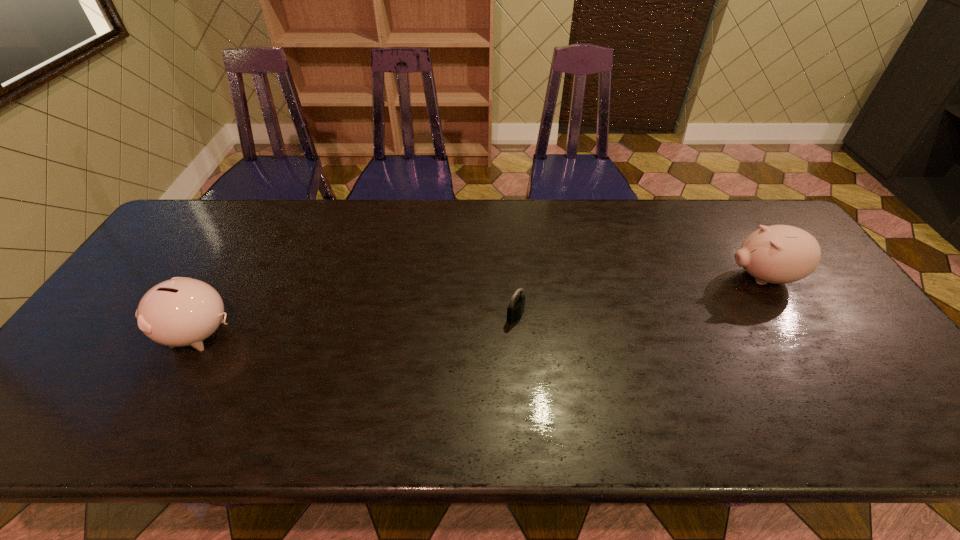
The height and width of the screenshot is (540, 960). Find the location of `vacant position located 0.180m on the front of the shortest object`. vacant position located 0.180m on the front of the shortest object is located at coordinates (520, 385).

I want to click on object that is at the right edge, so click(779, 254).

Image resolution: width=960 pixels, height=540 pixels. Identify the location of free spot at the far edge of the desktop. [610, 216].

Locate an element on the screen. This screenshot has width=960, height=540. vacant space at the near edge is located at coordinates click(193, 444).

I want to click on free spot at the left edge of the desktop, so click(174, 274).

This screenshot has width=960, height=540. What are the coordinates of `vacant area at the right edge of the desktop` in the screenshot? It's located at (804, 287).

This screenshot has height=540, width=960. Identify the location of unoccupied area between the shortest object and the nearer piggy bank. (358, 325).

Find the location of a particular element. free space between the padlock and the farthest object is located at coordinates (638, 296).

The width and height of the screenshot is (960, 540). I want to click on vacant area that lies between the padlock and the nearer piggy bank, so click(358, 325).

The height and width of the screenshot is (540, 960). I want to click on free space that is in between the leftmost object and the farther piggy bank, so click(481, 306).